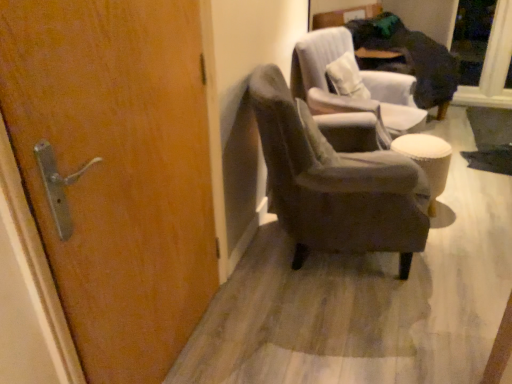
Question: Is velvet gray armchair at center, which is the first chair in back-to-front order, at the right side of velvet gray armchair at center, placed as the 1th chair when sorted from front to back?

Choices:
 (A) no
 (B) yes

Answer: (B)

Question: Is velvet gray armchair at center, which appears as the 2th chair when viewed from the front, located outside velvet gray armchair at center, placed as the 1th chair when sorted from front to back?

Choices:
 (A) yes
 (B) no

Answer: (A)

Question: Is the position of velvet gray armchair at center, which is the first chair in back-to-front order, less distant than that of velvet gray armchair at center, placed as the 2th chair when sorted from back to front?

Choices:
 (A) no
 (B) yes

Answer: (A)

Question: Can you confirm if velvet gray armchair at center, which appears as the 2th chair when viewed from the front, is smaller than velvet gray armchair at center, placed as the 2th chair when sorted from back to front?

Choices:
 (A) yes
 (B) no

Answer: (A)

Question: Does velvet gray armchair at center, which appears as the 2th chair when viewed from the front, appear on the left side of velvet gray armchair at center, placed as the 2th chair when sorted from back to front?

Choices:
 (A) no
 (B) yes

Answer: (A)

Question: Is point (120, 243) closer or farther from the camera than point (384, 170)?

Choices:
 (A) closer
 (B) farther

Answer: (A)

Question: Is wooden door at left wider or thinner than velvet gray armchair at center, placed as the 1th chair when sorted from front to back?

Choices:
 (A) thin
 (B) wide

Answer: (A)

Question: Is wooden door at left situated inside velvet gray armchair at center, placed as the 1th chair when sorted from front to back, or outside?

Choices:
 (A) outside
 (B) inside

Answer: (A)

Question: Relative to velvet gray armchair at center, placed as the 2th chair when sorted from back to front, is wooden door at left in front or behind?

Choices:
 (A) front
 (B) behind

Answer: (A)

Question: Is white fabric stool at right wider or thinner than velvet gray armchair at center, which is the first chair in back-to-front order?

Choices:
 (A) wide
 (B) thin

Answer: (B)

Question: From a real-world perspective, is white fabric stool at right physically located above or below velvet gray armchair at center, which appears as the 2th chair when viewed from the front?

Choices:
 (A) above
 (B) below

Answer: (B)

Question: Is white fabric stool at right in front of or behind velvet gray armchair at center, which appears as the 2th chair when viewed from the front, in the image?

Choices:
 (A) behind
 (B) front

Answer: (A)

Question: Is white fabric stool at right to the left or to the right of velvet gray armchair at center, which appears as the 2th chair when viewed from the front, in the image?

Choices:
 (A) right
 (B) left

Answer: (A)

Question: From the image's perspective, is wooden door at left above or below transparent glass door at upper right?

Choices:
 (A) below
 (B) above

Answer: (A)

Question: Based on their sizes in the image, would you say wooden door at left is bigger or smaller than transparent glass door at upper right?

Choices:
 (A) big
 (B) small

Answer: (A)